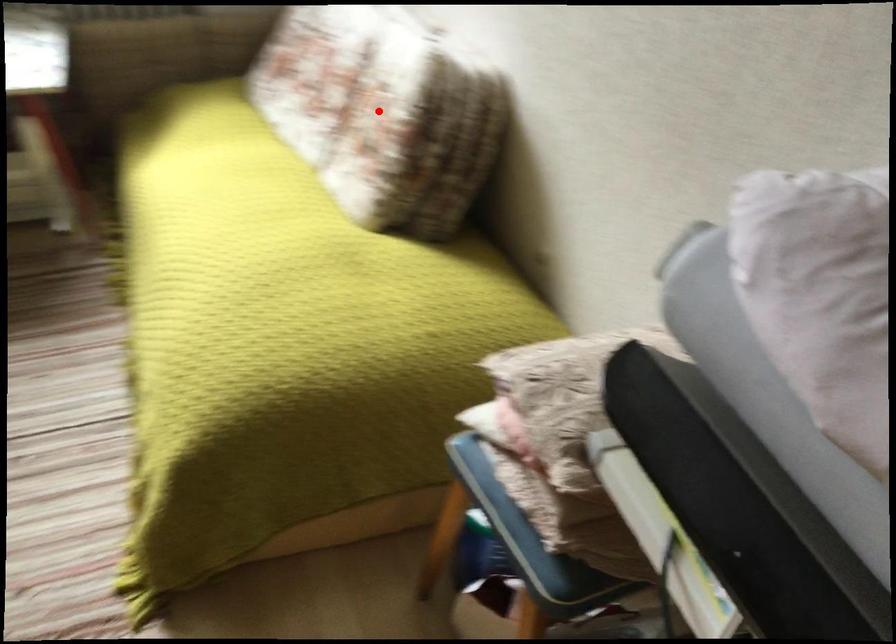
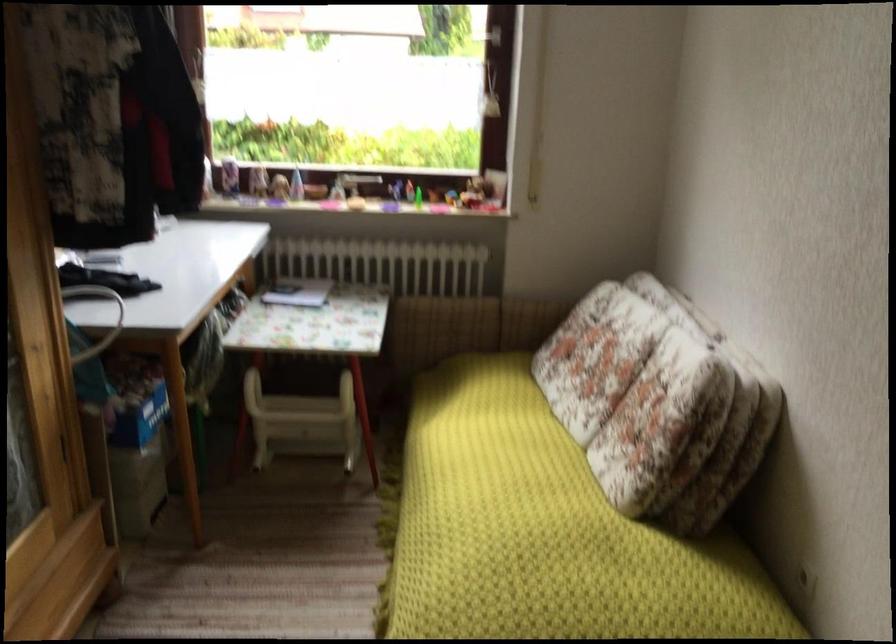
Locate, in the second image, the point that corresponds to the highlighted location in the first image.

(658, 402)